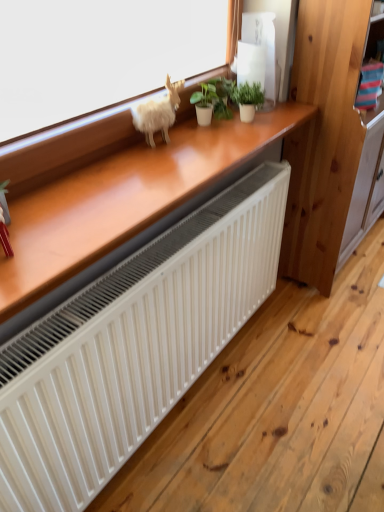
Question: Is green matte plant at upper center, marked as the 2th houseplant in a left-to-right arrangement, far from wooden dresser at right?

Choices:
 (A) yes
 (B) no

Answer: (B)

Question: Is green matte plant at upper center, marked as the 2th houseplant in a left-to-right arrangement, closer to the viewer compared to wooden dresser at right?

Choices:
 (A) yes
 (B) no

Answer: (B)

Question: From a real-world perspective, is green matte plant at upper center, placed as the first houseplant when sorted from right to left, below wooden dresser at right?

Choices:
 (A) yes
 (B) no

Answer: (B)

Question: Is green matte plant at upper center, placed as the first houseplant when sorted from right to left, facing away from wooden dresser at right?

Choices:
 (A) yes
 (B) no

Answer: (B)

Question: Is green matte plant at upper center, marked as the 2th houseplant in a left-to-right arrangement, shorter than wooden dresser at right?

Choices:
 (A) yes
 (B) no

Answer: (A)

Question: Is green matte plant at upper center, marked as the 2th houseplant in a left-to-right arrangement, thinner than wooden dresser at right?

Choices:
 (A) yes
 (B) no

Answer: (A)

Question: Is green matte plant at upper center, marked as the 2th houseplant in a left-to-right arrangement, not within green matte plant at center, arranged as the first houseplant when viewed from the left?

Choices:
 (A) yes
 (B) no

Answer: (A)

Question: From a real-world perspective, is green matte plant at upper center, placed as the first houseplant when sorted from right to left, over green matte plant at center, the second houseplant when ordered from right to left?

Choices:
 (A) no
 (B) yes

Answer: (B)

Question: Considering the relative sizes of green matte plant at upper center, placed as the first houseplant when sorted from right to left, and green matte plant at center, the second houseplant when ordered from right to left, in the image provided, is green matte plant at upper center, placed as the first houseplant when sorted from right to left, thinner than green matte plant at center, the second houseplant when ordered from right to left,?

Choices:
 (A) no
 (B) yes

Answer: (A)

Question: Is green matte plant at upper center, marked as the 2th houseplant in a left-to-right arrangement, in front of green matte plant at center, the second houseplant when ordered from right to left?

Choices:
 (A) no
 (B) yes

Answer: (B)

Question: Does green matte plant at upper center, marked as the 2th houseplant in a left-to-right arrangement, contain green matte plant at center, arranged as the first houseplant when viewed from the left?

Choices:
 (A) yes
 (B) no

Answer: (B)

Question: Does green matte plant at upper center, placed as the first houseplant when sorted from right to left, have a larger size compared to green matte plant at center, the second houseplant when ordered from right to left?

Choices:
 (A) no
 (B) yes

Answer: (A)

Question: From a real-world perspective, is fuzzy white animal at upper center under green matte plant at upper center, marked as the 2th houseplant in a left-to-right arrangement?

Choices:
 (A) no
 (B) yes

Answer: (A)